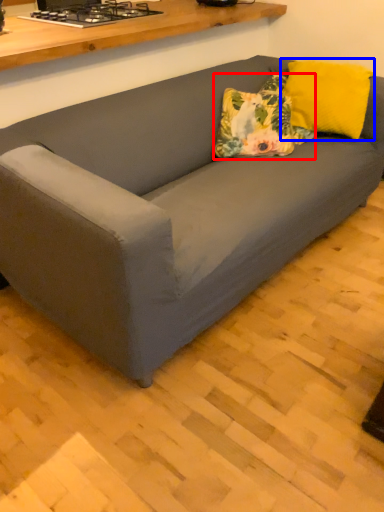
Question: Which point is further to the camera, throw pillow (highlighted by a red box) or pillow (highlighted by a blue box)?

Choices:
 (A) throw pillow
 (B) pillow

Answer: (B)